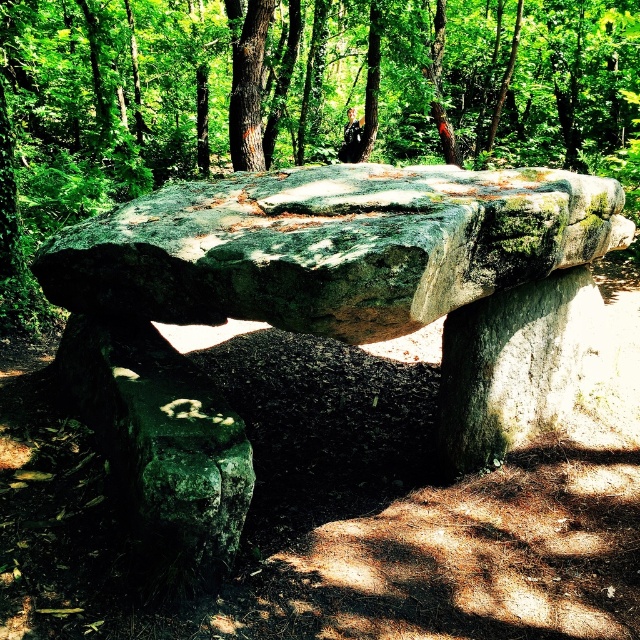
You are standing in the forest near the ancient stone structure. You notice two points marked on the ground. One is at coordinates point (236, 294) and the other is at point (545, 163). If you want to walk towards the point that is closer to you, which coordinate should you head towards?

You should head towards point (236, 294) because it is in front of point (545, 163), meaning it is closer to your current position.

You are a hiker exploring the forest and come across the ancient stone structure. You see the green mossy stone bench at center and the green mossy rock at center. Which one is positioned to the left side from your perspective?

The green mossy stone bench at center is positioned to the left of the green mossy rock at center.

You are a hiker who has stumbled upon this ancient stone structure in the forest. You want to sit down for a rest. Which of the two objects at the center, the green mossy stone bench at center or the green mossy rock at center, is more accessible for you to reach immediately?

The green mossy stone bench at center is closer to the viewer than the green mossy rock at center, so it is more accessible for you to reach immediately.